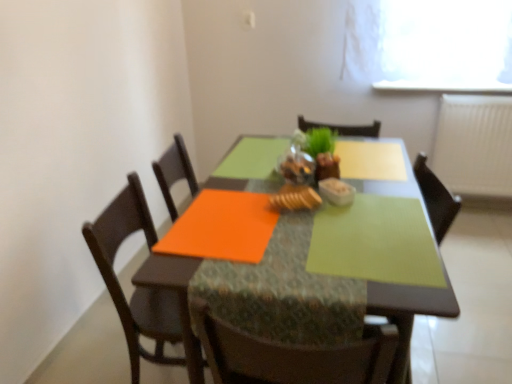
You are a GUI agent. You are given a task and a screenshot of the screen. Output one action in this format:
    pyautogui.click(x=<x>, y=<y>)
    Task: Click on the vacant region above white textured radiator at right (from a real-world perspective)
    The image size is (512, 384).
    Given the screenshot: What is the action you would take?
    pyautogui.click(x=479, y=95)